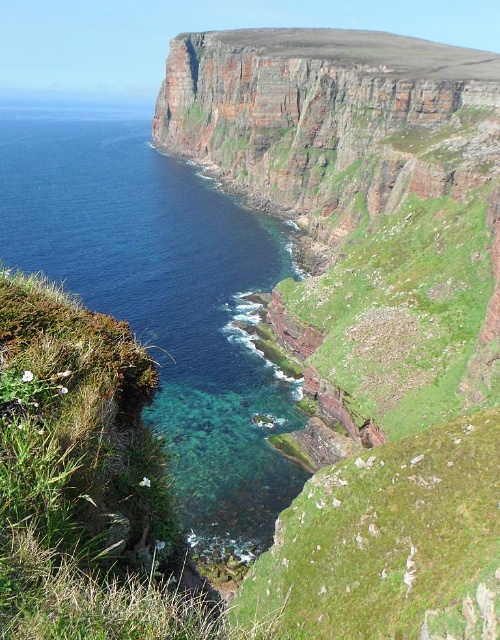
Question: Can you confirm if green grassy hillside at upper center is wider than clear blue water at lower left?

Choices:
 (A) no
 (B) yes

Answer: (A)

Question: Does green grassy hillside at upper center have a lesser width compared to clear blue water at lower left?

Choices:
 (A) yes
 (B) no

Answer: (A)

Question: Is green grassy hillside at upper center wider than clear blue water at lower left?

Choices:
 (A) no
 (B) yes

Answer: (A)

Question: Which object appears farthest from the camera in this image?

Choices:
 (A) green grassy hillside at upper center
 (B) clear blue water at lower left

Answer: (B)